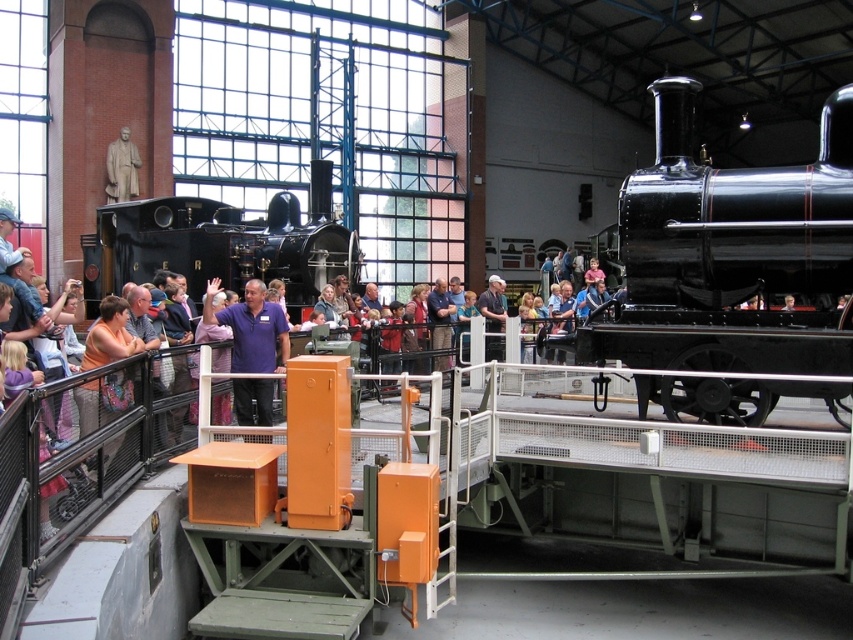
You are a visitor at the train exhibition and want to take a photo of the black polished locomotive at center and the purple shirt at center. Which object should you focus on first if you want to capture both in the same frame without moving your camera?

The black polished locomotive at center is located above the purple shirt at center, so you should focus on the purple shirt at center first to ensure both are in the frame.

You are a visitor at the train exhibition and want to take a photo of the purple shirt at center without the black polished locomotive at center blocking the view. Is this possible?

The purple shirt at center is behind the black polished locomotive at center, so it is currently blocked from view. To take a photo of the purple shirt at center without the locomotive blocking, you would need to move around to a position where the locomotive is not between you and the shirt.

You are an artist planning to sketch the scene. You want to ensure the proportions between the polished black steam locomotive at center and the purple shirt at center are accurate. Which object should you draw first if you want to start with the wider one?

The purple shirt at center is wider than the polished black steam locomotive at center, so you should draw the purple shirt at center first to start with the wider object.